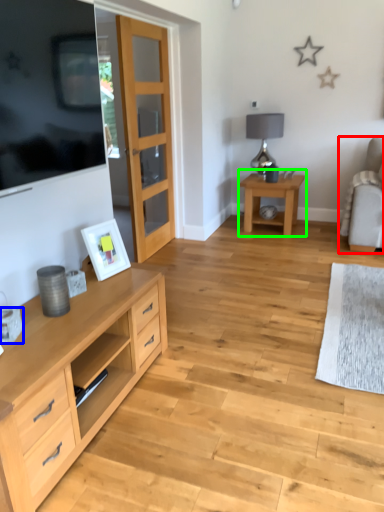
Question: Which object is positioned farthest from chair (highlighted by a red box)? Select from coffee cup (highlighted by a blue box) and table (highlighted by a green box).

Choices:
 (A) coffee cup
 (B) table

Answer: (A)